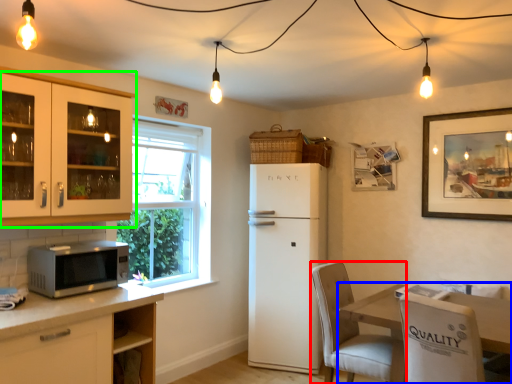
Question: Which is nearer to the chair (highlighted by a red box)? table (highlighted by a blue box) or cabinetry (highlighted by a green box).

Choices:
 (A) table
 (B) cabinetry

Answer: (A)